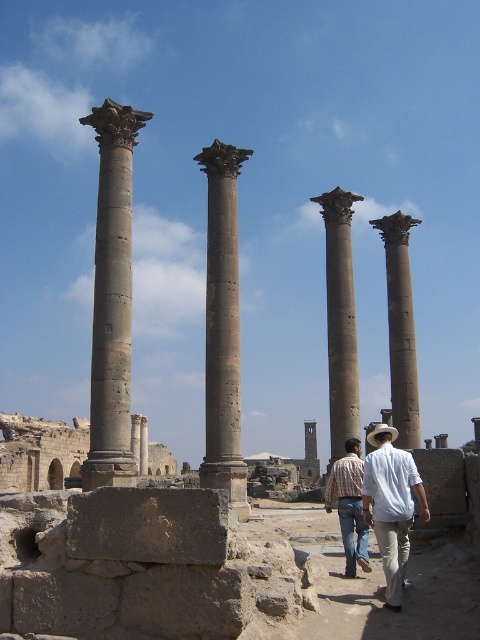
You are standing at the center of the archaeological site and want to take a photo of the dark gray stone arch at center. Which direction should you face to ensure the arch is in the center of your photo?

Since the dark gray stone arch at center is located at coordinates point (40, 452), you should face towards the direction where the arch is positioned to center it in your photo. The exact direction depends on your current orientation, but based on its coordinates, it is positioned to the right and slightly forward from the center point.

You are standing at the camera position and want to walk to the point labeled as point (12, 476). There is an obstacle at point (215, 179). Will you encounter the obstacle before reaching your destination?

Yes, you will encounter the obstacle at point (215, 179) before reaching the destination at point (12, 476) because point (215, 179) is closer to the camera than point (12, 476).